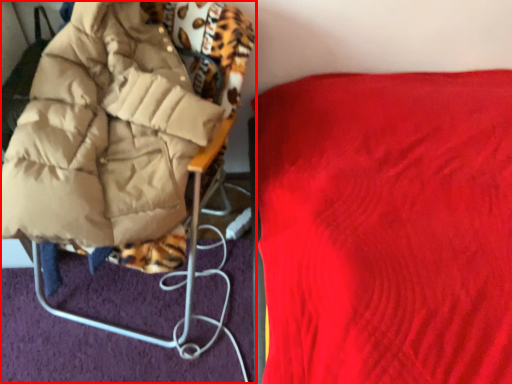
Question: From the image's perspective, what is the correct spatial positioning of furniture (annotated by the red box) in reference to furniture?

Choices:
 (A) below
 (B) above

Answer: (B)